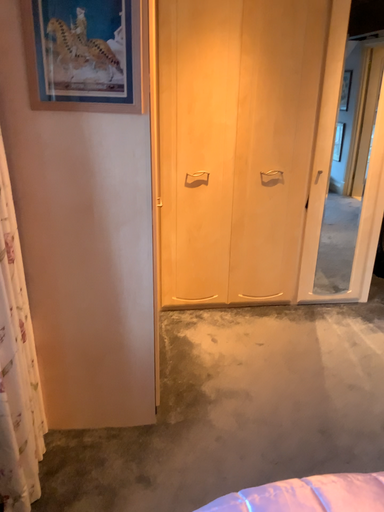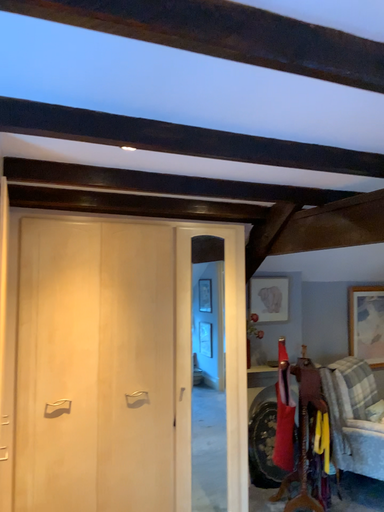
Question: Which way did the camera rotate in the video?

Choices:
 (A) rotated downward
 (B) rotated upward

Answer: (B)